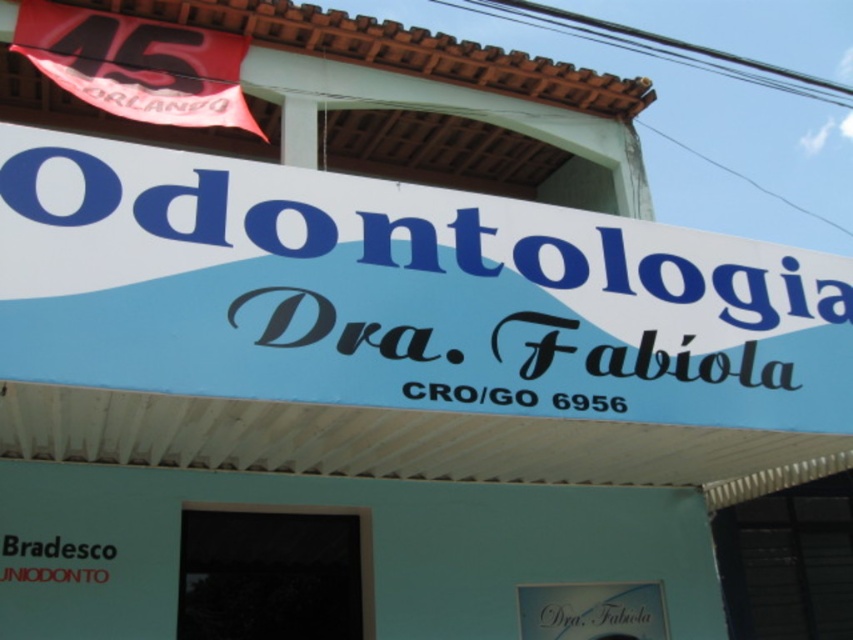
Question: Which point is closer to the camera?

Choices:
 (A) (76, 374)
 (B) (532, 596)

Answer: (A)

Question: Can you confirm if white plastic sign at center is positioned to the right of white glossy signboard at center?

Choices:
 (A) no
 (B) yes

Answer: (A)

Question: Does white plastic sign at center have a smaller size compared to white glossy signboard at center?

Choices:
 (A) no
 (B) yes

Answer: (A)

Question: In this image, where is white plastic sign at center located relative to white glossy signboard at center?

Choices:
 (A) above
 (B) below

Answer: (A)